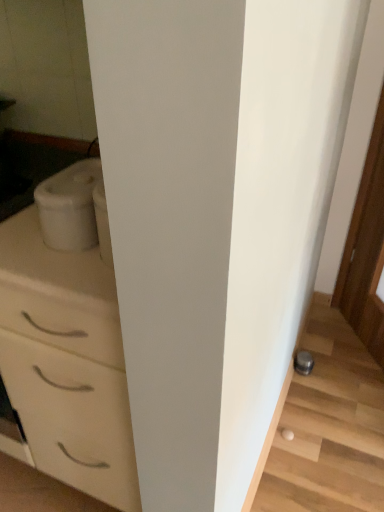
Question: Based on their sizes in the image, would you say white matte container at left is bigger or smaller than metallic gray stairwell at lower right?

Choices:
 (A) big
 (B) small

Answer: (B)

Question: Considering their positions, is white matte container at left located in front of or behind metallic gray stairwell at lower right?

Choices:
 (A) behind
 (B) front

Answer: (B)

Question: Which is farther from the white glossy chest of drawers at left?

Choices:
 (A) white matte container at left
 (B) metallic gray stairwell at lower right

Answer: (B)

Question: Which object is positioned closest to the metallic gray stairwell at lower right?

Choices:
 (A) white glossy chest of drawers at left
 (B) white matte container at left

Answer: (A)